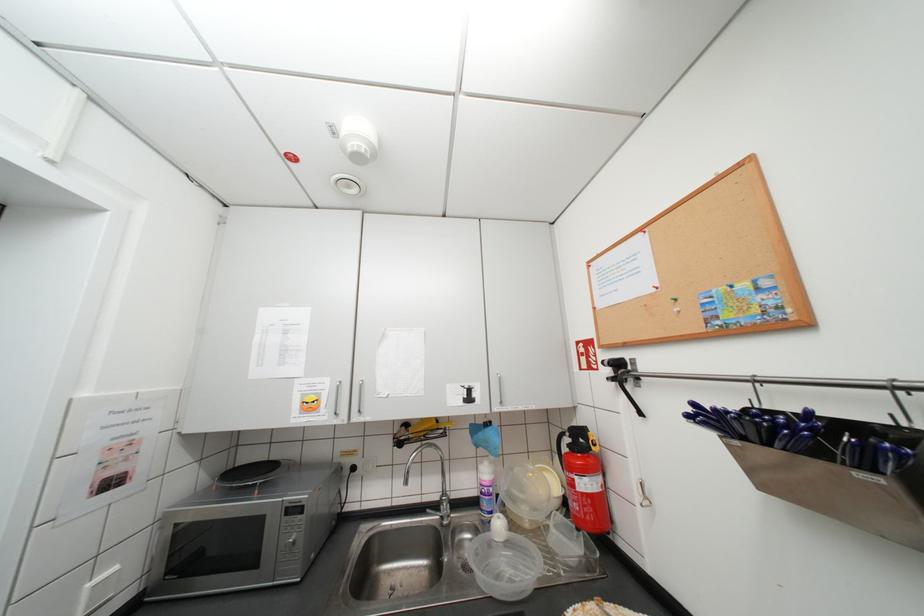
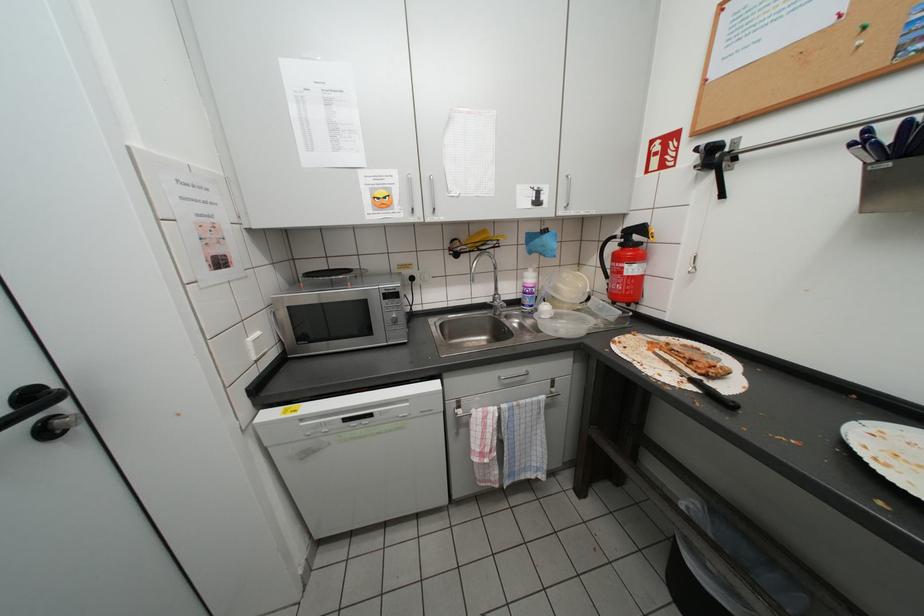
Question: Based on the continuous images, in which direction is the camera rotating? Reply with the corresponding letter.

Choices:
 (A) Left
 (B) Right
 (C) Up
 (D) Down

Answer: (D)